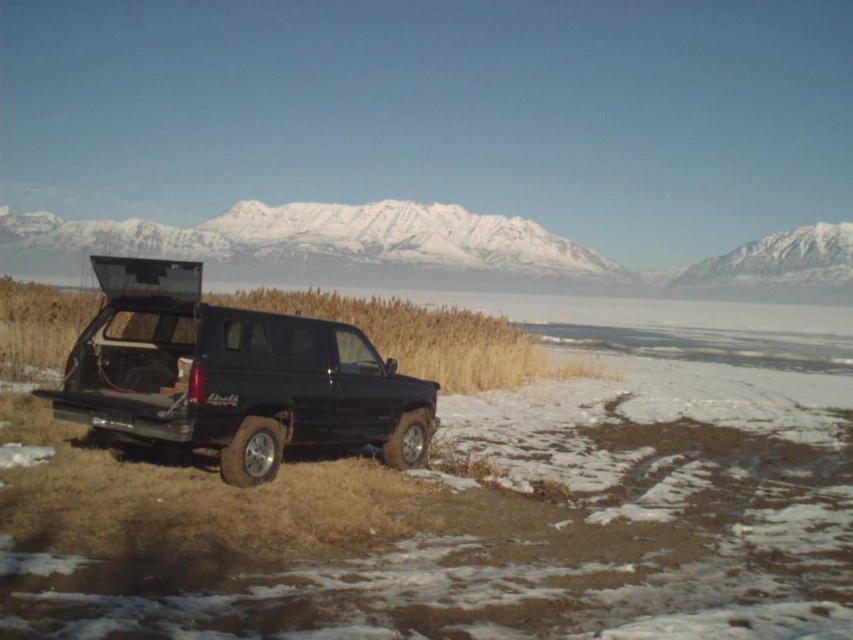
You are standing at the point with coordinates point (828, 298) and want to walk to the point with coordinates point (341, 417). Which direction should you move relative to the SUV parked on the snow?

You should move towards the front of the SUV parked on the snow because point (341, 417) is in front of point (828, 298).

You are a photographer wanting to capture the black matte truck at center and the snowy white mountain at upper center in the same frame. Based on their positions, which object will appear closer to the camera in the photo?

The black matte truck at center is in front of the snowy white mountain at upper center, so it will appear closer to the camera in the photo.

You are a photographer planning to take a landscape photo of the snowy white mountain at upper center. The black matte truck at center is blocking your view. Can you move the truck to the side to get a clear shot of the mountain?

The black matte truck at center is below the snowy white mountain at upper center, so moving the truck to the side would allow you to capture the mountain without obstruction.